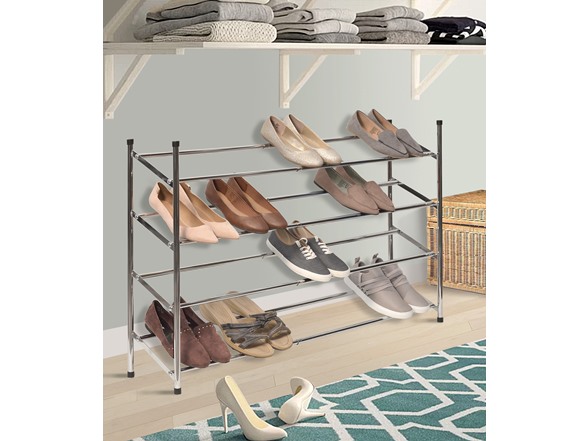
Locate an element on the screen. This screenshot has width=588, height=441. towels is located at coordinates click(x=236, y=10), click(x=233, y=33), click(x=293, y=3), click(x=314, y=15), click(x=323, y=29), click(x=329, y=38), click(x=390, y=9), click(x=397, y=21), click(x=396, y=36).